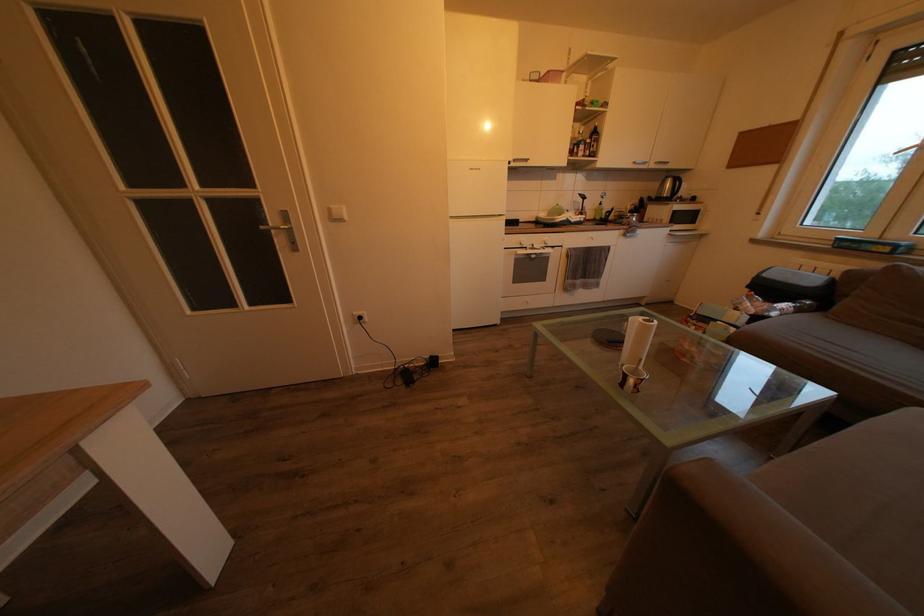
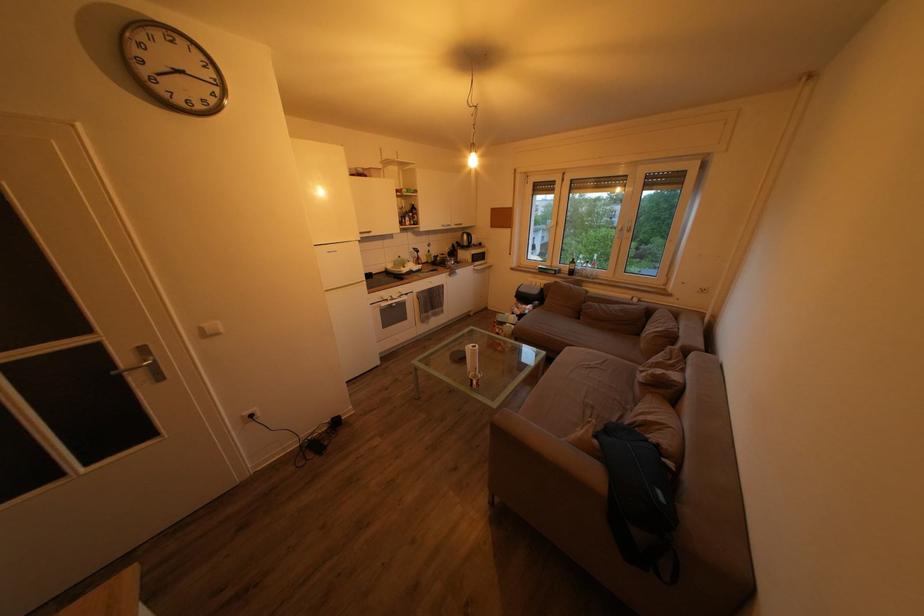
Find the pixel in the second image that matches point (294, 223) in the first image.

(151, 357)